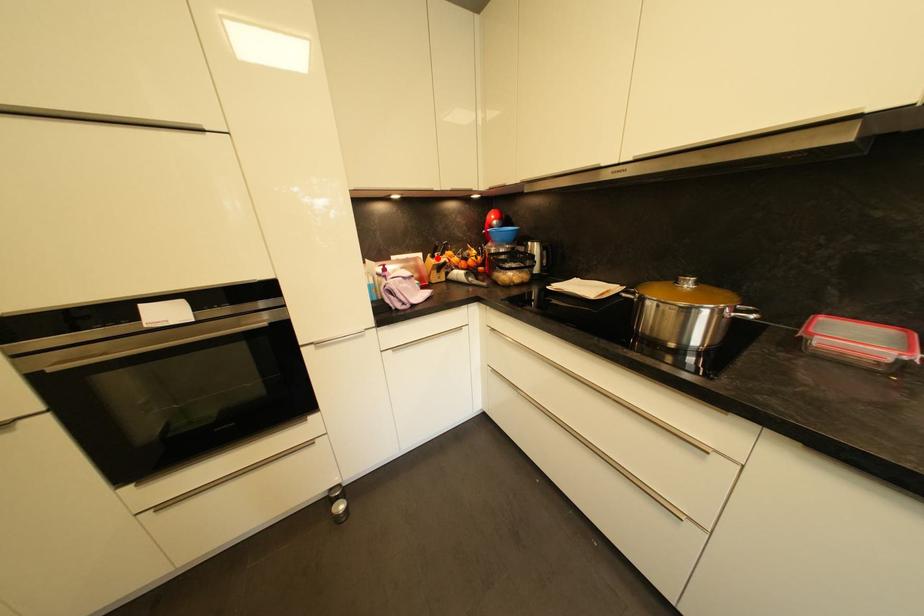
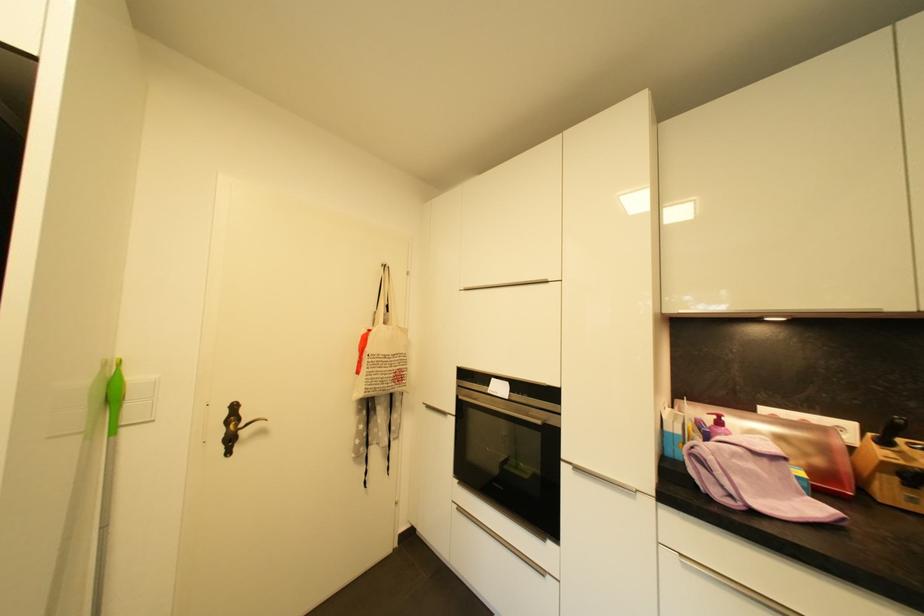
Find the pixel in the second image that matches the highlighted location in the first image.

(890, 445)